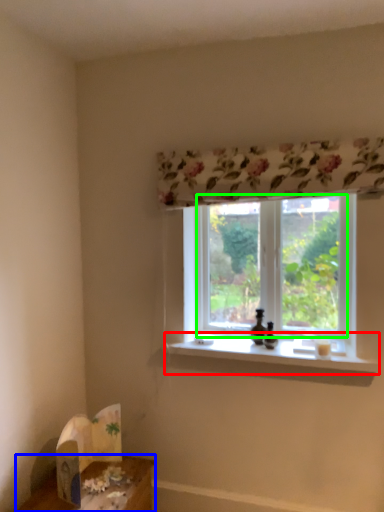
Question: Which object is the closest to the window sill (highlighted by a red box)? Choose among these: table (highlighted by a blue box) or window screen (highlighted by a green box).

Choices:
 (A) table
 (B) window screen

Answer: (B)